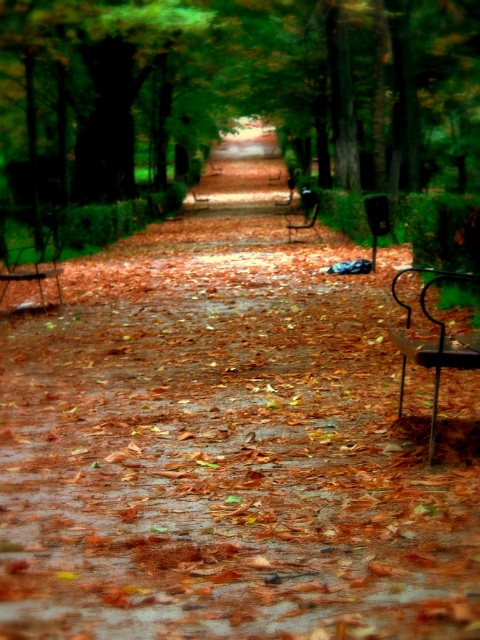
Question: Among these objects, which one is nearest to the camera?

Choices:
 (A) metallic silver bench at center
 (B) wooden bench at left

Answer: (B)

Question: Considering the relative positions of metallic black bench at right and wooden bench at left in the image provided, where is metallic black bench at right located with respect to wooden bench at left?

Choices:
 (A) right
 (B) left

Answer: (A)

Question: Which point appears farthest from the camera in this image?

Choices:
 (A) (312, 221)
 (B) (407, 269)
 (C) (57, 276)

Answer: (A)

Question: Which point appears closest to the camera in this image?

Choices:
 (A) (54, 253)
 (B) (479, 352)
 (C) (303, 227)

Answer: (B)

Question: Is wooden bench at left wider than metallic silver bench at center?

Choices:
 (A) yes
 (B) no

Answer: (A)

Question: Does metallic black bench at right appear over metallic silver bench at center?

Choices:
 (A) yes
 (B) no

Answer: (B)